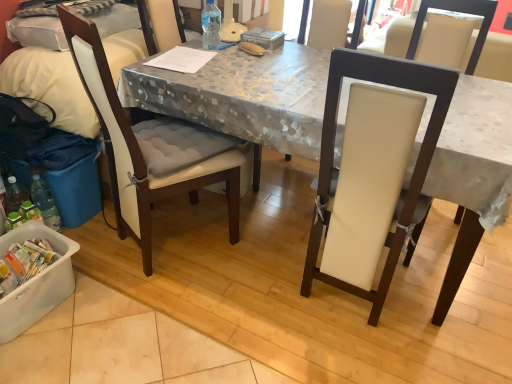
Identify the location of vacant space that is in between white padded chair at left, the 2th chair positioned from the right, and white plastic container at lower left. (88, 298).